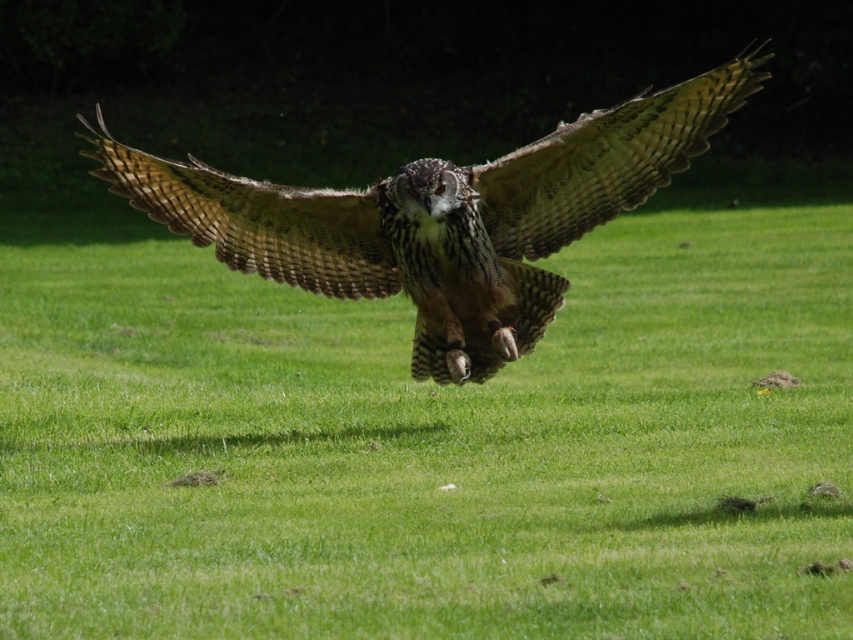
Is green grassy field at center below brown feathered eagle at center?

Correct, green grassy field at center is located below brown feathered eagle at center.

The width and height of the screenshot is (853, 640). Find the location of `green grassy field at center`. green grassy field at center is located at coordinates (431, 436).